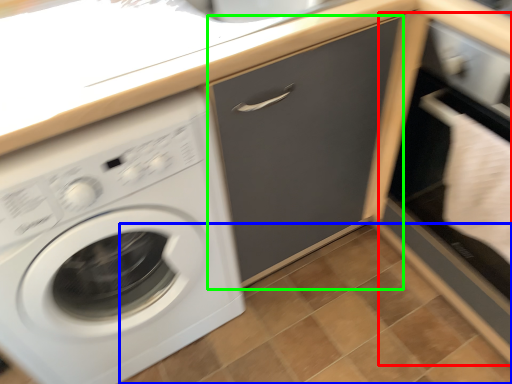
Question: Based on their relative distances, which object is farther from file cabinet (highlighted by a red box)? Choose from tile (highlighted by a blue box) and drawer (highlighted by a green box).

Choices:
 (A) tile
 (B) drawer

Answer: (A)